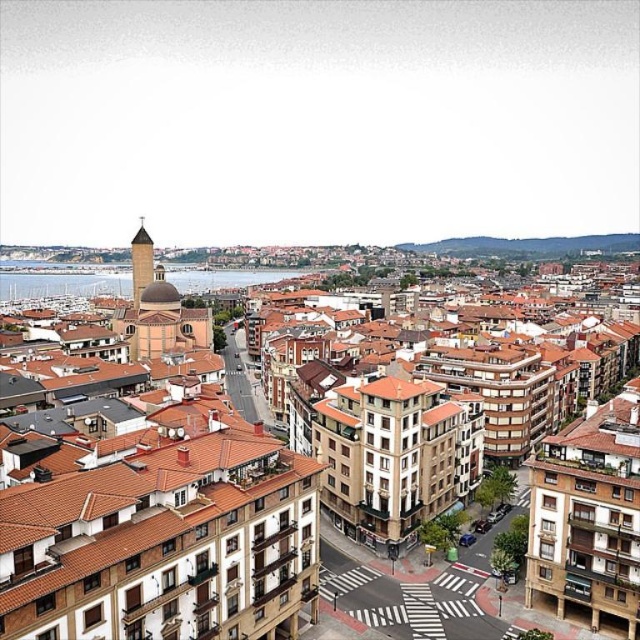
You are a city planner assessing the distance between two landmarks in this urban area. The brown brick building at center and the smooth stone bell tower at upper center are key points. Given that the city requires a minimum of 300 feet between major landmarks for emergency vehicle access, does this distance meet the requirement?

The brown brick building at center and the smooth stone bell tower at upper center are 355.16 feet apart, which exceeds the required 300 feet minimum distance. Therefore, the distance between them meets the city requirement for emergency vehicle access.

You are standing at the point labeled as point [61,284] in the image. What is the color of the area you are currently standing on?

The point [61,284] corresponds to blue water at center, so the area you are standing on is blue water.

You are a city planner analyzing this urban layout. Given the presence of the blue water at center and the smooth stone bell tower at upper center, which of these two features occupies a larger horizontal space in the image?

The blue water at center has a greater width than the smooth stone bell tower at upper center, so it occupies a larger horizontal space in the image.